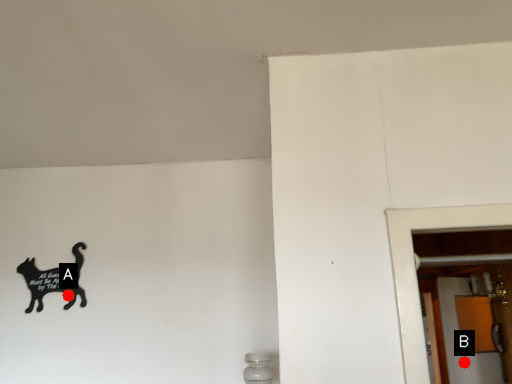
Question: Two points are circled on the image, labeled by A and B beside each circle. Which point is farther to the camera?

Choices:
 (A) A is further
 (B) B is further

Answer: (B)